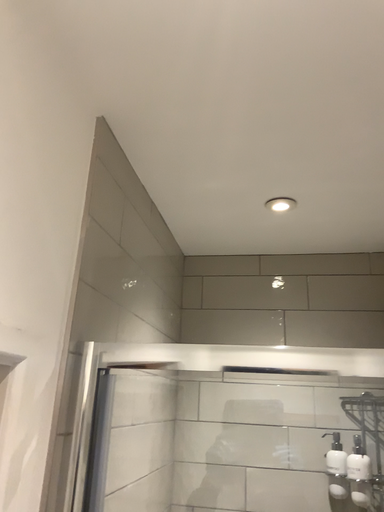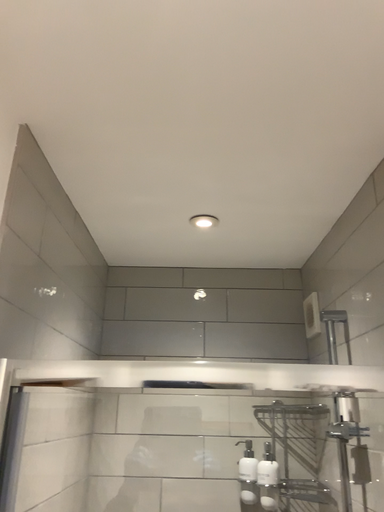
Question: Which way did the camera rotate in the video?

Choices:
 (A) rotated left
 (B) rotated right

Answer: (B)